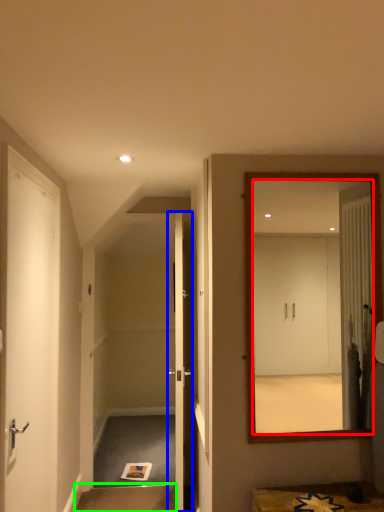
Question: Based on their relative distances, which object is nearer to mirror (highlighted by a red box)? Choose from door (highlighted by a blue box) and stair (highlighted by a green box).

Choices:
 (A) door
 (B) stair

Answer: (A)